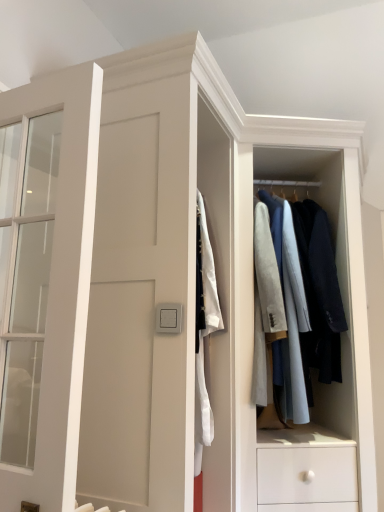
Question: From a real-world perspective, is light gray fabric coat rack at center beneath matte white door at left?

Choices:
 (A) yes
 (B) no

Answer: (B)

Question: Is light gray fabric coat rack at center directly adjacent to matte white door at left?

Choices:
 (A) no
 (B) yes

Answer: (A)

Question: Could you tell me if light gray fabric coat rack at center is facing matte white door at left?

Choices:
 (A) yes
 (B) no

Answer: (B)

Question: From the image's perspective, does light gray fabric coat rack at center appear lower than matte white door at left?

Choices:
 (A) yes
 (B) no

Answer: (A)

Question: Does light gray fabric coat rack at center have a lesser width compared to matte white door at left?

Choices:
 (A) no
 (B) yes

Answer: (A)

Question: Can you confirm if light gray fabric coat rack at center is taller than matte white door at left?

Choices:
 (A) yes
 (B) no

Answer: (A)

Question: Considering the relative sizes of satin silver switch at center and matte white door at left in the image provided, is satin silver switch at center wider than matte white door at left?

Choices:
 (A) yes
 (B) no

Answer: (B)

Question: Is satin silver switch at center positioned far away from matte white door at left?

Choices:
 (A) no
 (B) yes

Answer: (A)

Question: From a real-world perspective, is satin silver switch at center physically above matte white door at left?

Choices:
 (A) no
 (B) yes

Answer: (A)

Question: Would you say matte white door at left is part of satin silver switch at center's contents?

Choices:
 (A) no
 (B) yes

Answer: (A)

Question: Does satin silver switch at center lie behind matte white door at left?

Choices:
 (A) no
 (B) yes

Answer: (B)

Question: Is satin silver switch at center at the left side of matte white door at left?

Choices:
 (A) yes
 (B) no

Answer: (B)

Question: Can you confirm if matte white door at left is thinner than satin silver switch at center?

Choices:
 (A) yes
 (B) no

Answer: (B)